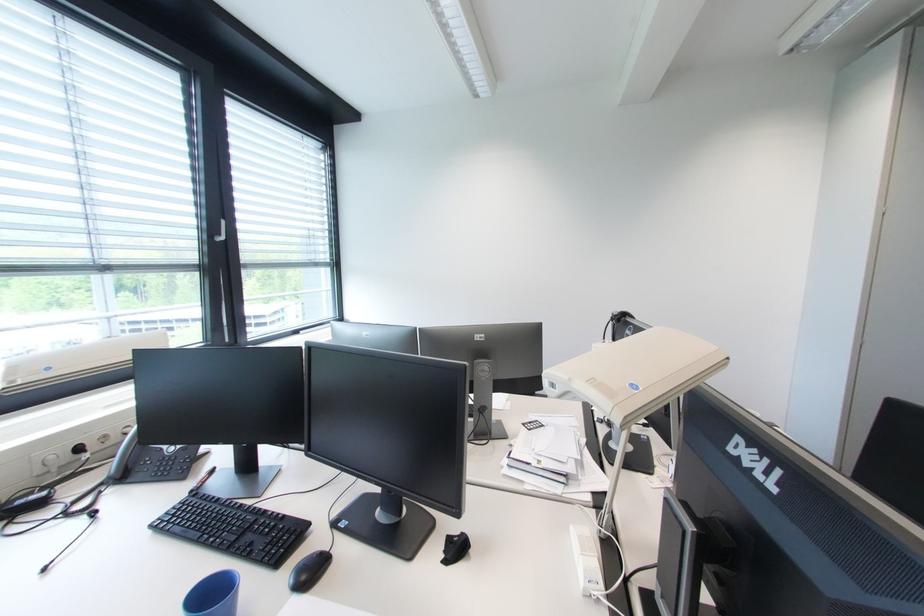
Locate an element on the screen. This screenshot has height=616, width=924. keyboard keys is located at coordinates (234, 529).